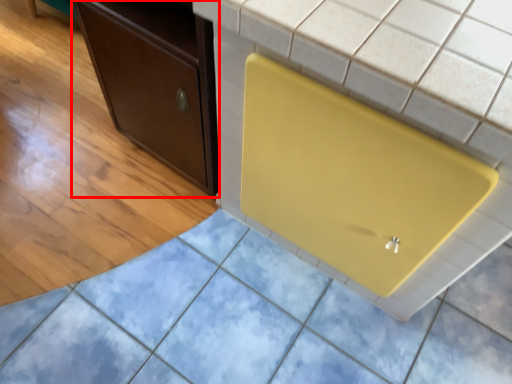
Question: Where is cabinetry (annotated by the red box) located in relation to appliance in the image?

Choices:
 (A) left
 (B) right

Answer: (A)